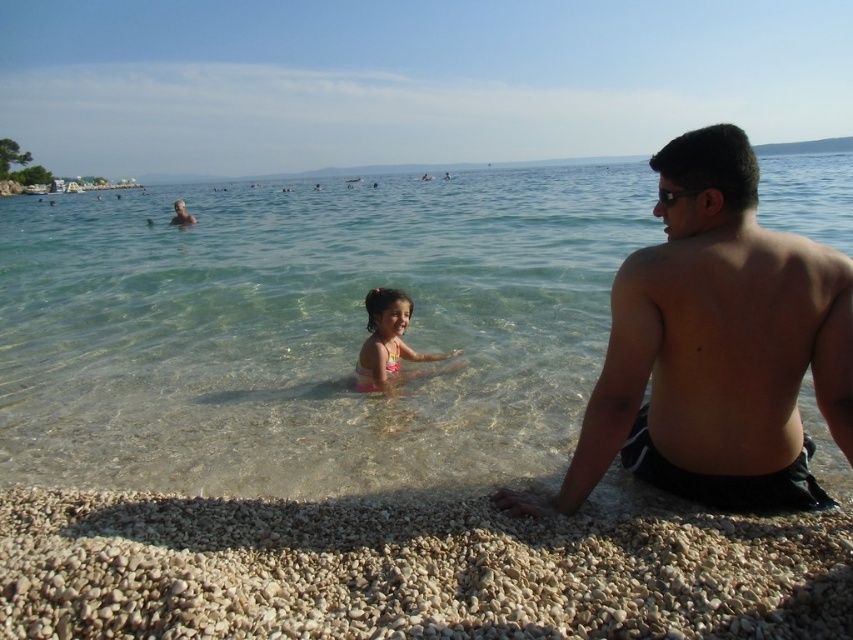
You are a photographer standing on the beach and want to take a photo of the clear water at center and the smooth skin man at upper left. Based on their positions, which object is located higher in the image?

The clear water at center is above the smooth skin man at upper left, so it is higher in the image.

You are standing on the pebble shore and want to reach the clear water at center. According to the coordinates given, which direction should you move to get there?

You should move towards the center of the image since the clear water at center is located at coordinates point (308, 330), which is near the middle of the scene.

You are standing on the beach and want to walk from point A to point B. Point A is at coordinates point [502,412] and point B is at coordinates point [357,536]. Which point is closer to you when you start walking?

Point A at coordinates point [502,412] is closer to you than point B at coordinates point [357,536] because it is further to the viewer.